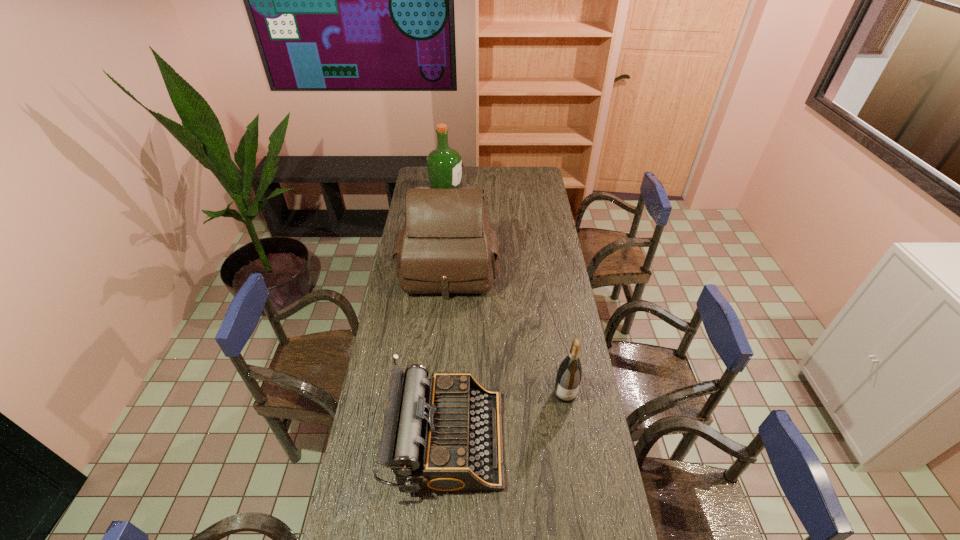
This screenshot has height=540, width=960. What are the coordinates of `satchel located in the left edge section of the desktop` in the screenshot? It's located at (446, 246).

In order to click on liquor at the left edge in this screenshot , I will do `click(444, 165)`.

You are a GUI agent. You are given a task and a screenshot of the screen. Output one action in this format:
    pyautogui.click(x=<x>, y=<y>)
    Task: Click on the typewriter present at the left edge
    The height and width of the screenshot is (540, 960).
    Given the screenshot: What is the action you would take?
    pyautogui.click(x=444, y=434)

Find the location of `object present at the right edge`. object present at the right edge is located at coordinates (569, 374).

You are a GUI agent. You are given a task and a screenshot of the screen. Output one action in this format:
    pyautogui.click(x=<x>, y=<y>)
    Task: Click on the object present at the far left corner
    
    Given the screenshot: What is the action you would take?
    pyautogui.click(x=444, y=165)

Identify the location of free spot at the left edge of the desktop. The image size is (960, 540). (382, 367).

Where is `free space at the right edge of the desktop`? The height and width of the screenshot is (540, 960). free space at the right edge of the desktop is located at coordinates (556, 275).

I want to click on vacant space at the far left corner, so click(426, 179).

You are a GUI agent. You are given a task and a screenshot of the screen. Output one action in this format:
    pyautogui.click(x=<x>, y=<y>)
    Task: Click on the free spot at the far right corner of the desktop
    
    Given the screenshot: What is the action you would take?
    pyautogui.click(x=521, y=181)

Where is `free space that is in between the rightmost object and the farthest object`? free space that is in between the rightmost object and the farthest object is located at coordinates (506, 292).